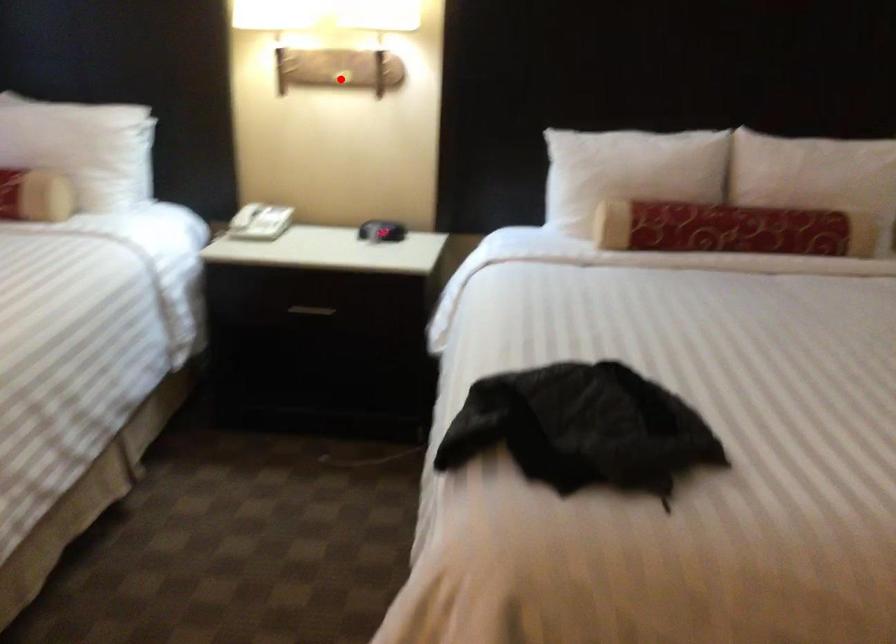
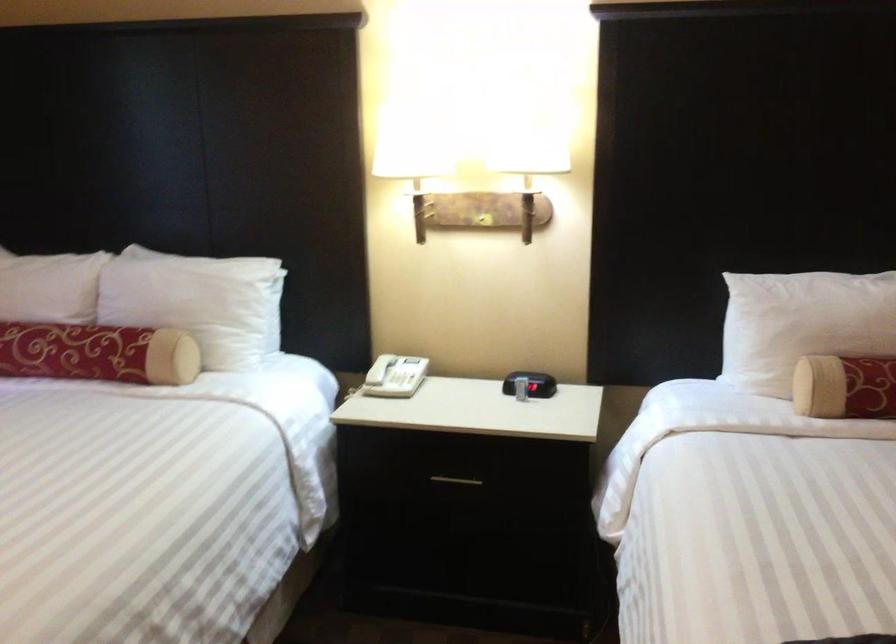
Where in the second image is the point corresponding to the highlighted location from the first image?

(483, 220)